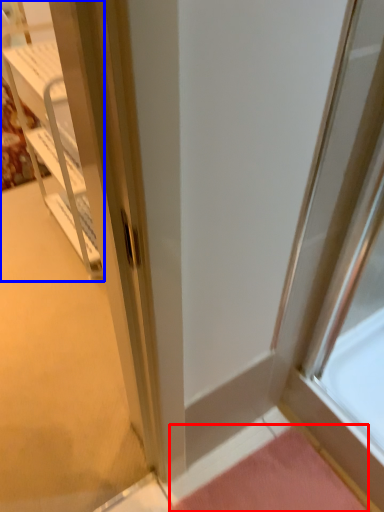
Question: Which object is closer to the camera taking this photo, doormat (highlighted by a red box) or cabinetry (highlighted by a blue box)?

Choices:
 (A) doormat
 (B) cabinetry

Answer: (A)